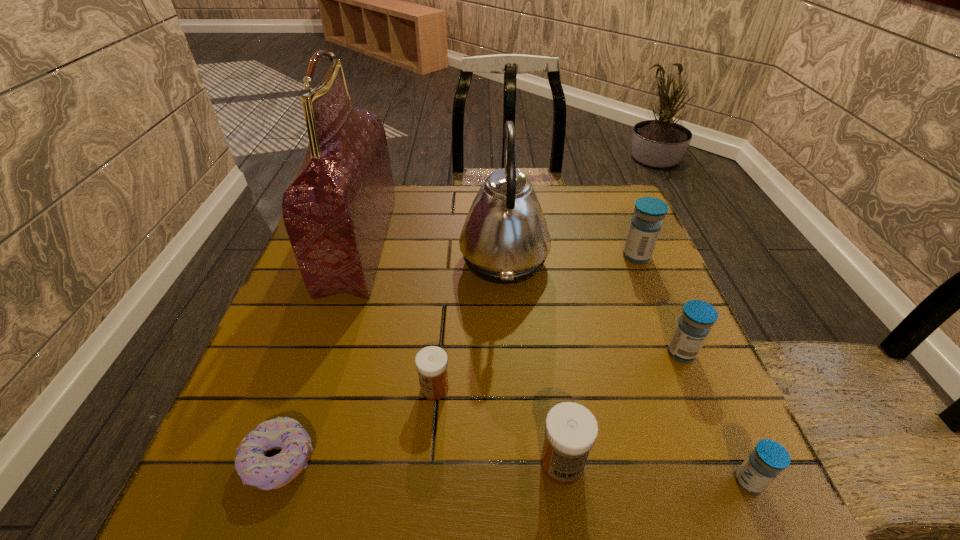
In order to click on object present at the near right corner in this screenshot , I will do tap(767, 460).

In the image, there is a desktop. Where is `vacant region at the far edge`? vacant region at the far edge is located at coordinates (446, 222).

Image resolution: width=960 pixels, height=540 pixels. In the image, there is a desktop. Find the location of `vacant space at the near edge`. vacant space at the near edge is located at coordinates (482, 511).

The height and width of the screenshot is (540, 960). Identify the location of free region at the left edge of the desktop. (316, 340).

In the image, there is a desktop. At what (x,y) coordinates should I click in order to perform the action: click on vacant space at the right edge. Please return your answer as a coordinate pair (x, y). Image resolution: width=960 pixels, height=540 pixels. Looking at the image, I should click on (593, 254).

Locate an element on the screen. The height and width of the screenshot is (540, 960). vacant space at the near left corner of the desktop is located at coordinates (200, 488).

In the image, there is a desktop. In order to click on vacant space at the far right corner in this screenshot , I will do `click(620, 201)`.

You are a GUI agent. You are given a task and a screenshot of the screen. Output one action in this format:
    pyautogui.click(x=<x>, y=<y>)
    Task: Click on the empty space between the second farthest medicine and the kettle
    The width and height of the screenshot is (960, 540).
    Given the screenshot: What is the action you would take?
    pyautogui.click(x=592, y=306)

Where is `vacant space that's between the seventh shortest object and the nearest blue medicine`? vacant space that's between the seventh shortest object and the nearest blue medicine is located at coordinates (627, 370).

Find the location of a particular element. vacant area that lies between the smaller white medicine and the second biggest blue medicine is located at coordinates (558, 371).